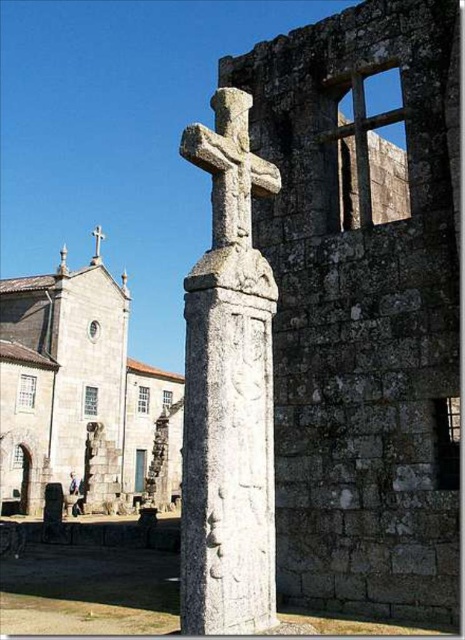
Does gray stone cross at center have a greater height compared to gray stone church at center?

Incorrect, gray stone cross at center's height is not larger of gray stone church at center's.

Where is `gray stone cross at center`? The height and width of the screenshot is (640, 465). gray stone cross at center is located at coordinates (228, 392).

Describe the element at coordinates (228, 392) in the screenshot. I see `gray stone cross at center` at that location.

Where is `gray stone cross at center`? gray stone cross at center is located at coordinates (228, 392).

Image resolution: width=465 pixels, height=640 pixels. Describe the element at coordinates (80, 396) in the screenshot. I see `gray stone church at center` at that location.

Who is lower down, gray stone church at center or white stone cross at center?

gray stone church at center is below.

Is point (18, 317) less distant than point (99, 225)?

Yes, it is in front of point (99, 225).

I want to click on gray stone church at center, so click(80, 396).

Between gray stone cross at center and white stone cross at center, which one appears on the right side from the viewer's perspective?

Positioned to the right is gray stone cross at center.

Is gray stone cross at center positioned before white stone cross at center?

Yes, gray stone cross at center is closer to the viewer.

The height and width of the screenshot is (640, 465). Find the location of `gray stone cross at center`. gray stone cross at center is located at coordinates (228, 392).